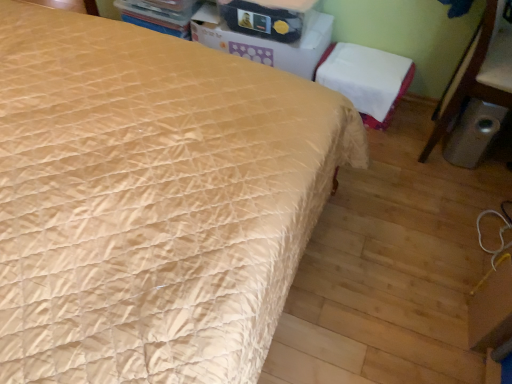
The image size is (512, 384). Find the location of `vacant point to the left of metallic trash can at lower right`. vacant point to the left of metallic trash can at lower right is located at coordinates (386, 174).